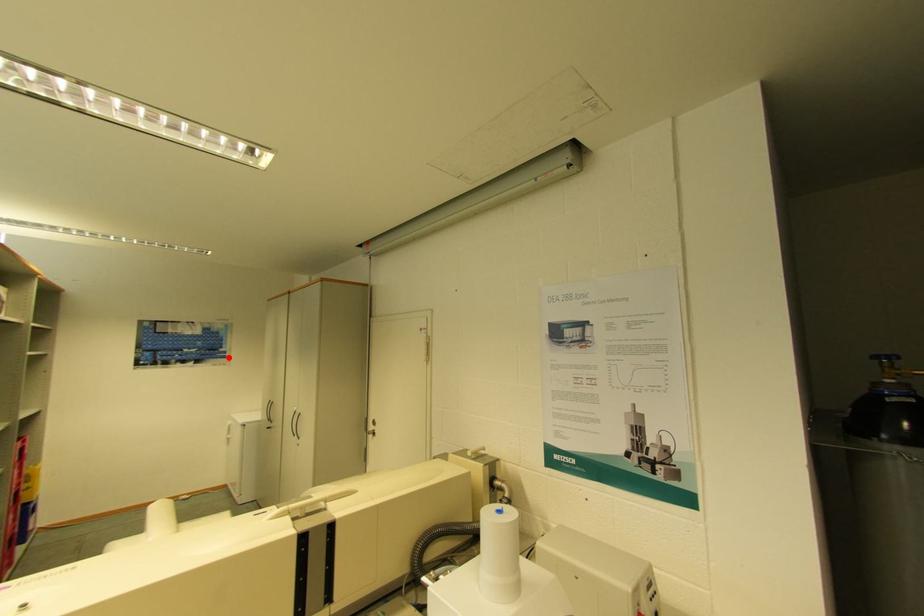
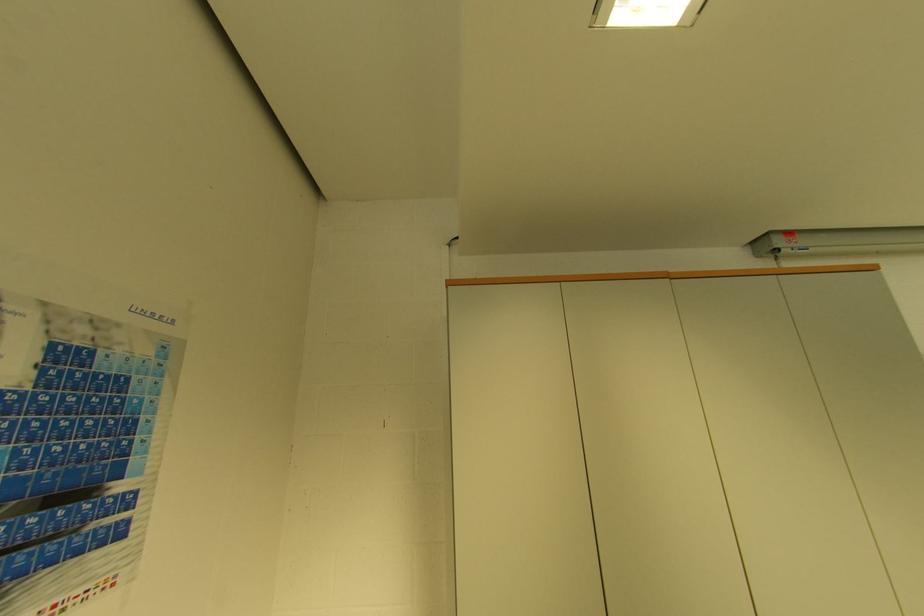
Question: I am providing you with two images of the same scene from different viewpoints. Given a red point in image1, look at the same physical point in image2. Is it:

Choices:
 (A) Closer to the viewpoint
 (B) Farther from the viewpoint

Answer: (A)